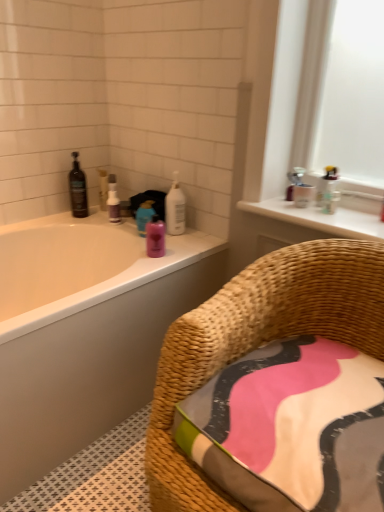
Where is `free location in front of white glossy bottle at upper center, the 1th cleaning product when ordered from right to left`? The width and height of the screenshot is (384, 512). free location in front of white glossy bottle at upper center, the 1th cleaning product when ordered from right to left is located at coordinates (178, 243).